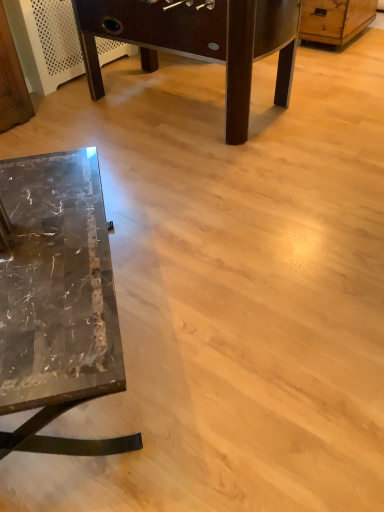
Question: Can we say wooden dresser at upper right lies outside marble table at lower left, which is the 2th table in bottom-to-top order?

Choices:
 (A) no
 (B) yes

Answer: (B)

Question: Is wooden dresser at upper right with marble table at lower left, which is the 1th table in top-to-bottom order?

Choices:
 (A) yes
 (B) no

Answer: (B)

Question: Does wooden dresser at upper right appear on the left side of marble table at lower left, which is the 1th table in top-to-bottom order?

Choices:
 (A) no
 (B) yes

Answer: (A)

Question: Does wooden dresser at upper right appear on the right side of marble table at lower left, the 1th table from the back?

Choices:
 (A) no
 (B) yes

Answer: (B)

Question: From the image's perspective, is wooden dresser at upper right on marble table at lower left, which is the 2th table in bottom-to-top order?

Choices:
 (A) yes
 (B) no

Answer: (A)

Question: Are wooden dresser at upper right and marble table at lower left, which ranks as the second table in front-to-back order, far apart?

Choices:
 (A) no
 (B) yes

Answer: (B)

Question: Is marble table at lower left, which is the 2th table in top-to-bottom order, positioned behind marble table at lower left, which is the 1th table in top-to-bottom order?

Choices:
 (A) no
 (B) yes

Answer: (A)

Question: Is marble table at lower left, which is the second table in back-to-front order, positioned beyond the bounds of marble table at lower left, which ranks as the second table in front-to-back order?

Choices:
 (A) yes
 (B) no

Answer: (A)

Question: Can you confirm if marble table at lower left, the first table when ordered from bottom to top, is positioned to the left of marble table at lower left, the 1th table from the back?

Choices:
 (A) yes
 (B) no

Answer: (A)

Question: Is marble table at lower left, which is the 2th table in top-to-bottom order, positioned before marble table at lower left, which ranks as the second table in front-to-back order?

Choices:
 (A) no
 (B) yes

Answer: (B)

Question: Can you confirm if marble table at lower left, the first table when ordered from bottom to top, is taller than marble table at lower left, which is the 2th table in bottom-to-top order?

Choices:
 (A) yes
 (B) no

Answer: (B)

Question: Considering the relative sizes of marble table at lower left, which is the second table in back-to-front order, and marble table at lower left, which is the 2th table in bottom-to-top order, in the image provided, is marble table at lower left, which is the second table in back-to-front order, bigger than marble table at lower left, which is the 2th table in bottom-to-top order,?

Choices:
 (A) no
 (B) yes

Answer: (A)

Question: Can we say marble table at lower left, the 1th table from the back, lies outside marble table at lower left, which is the 2th table in top-to-bottom order?

Choices:
 (A) no
 (B) yes

Answer: (B)